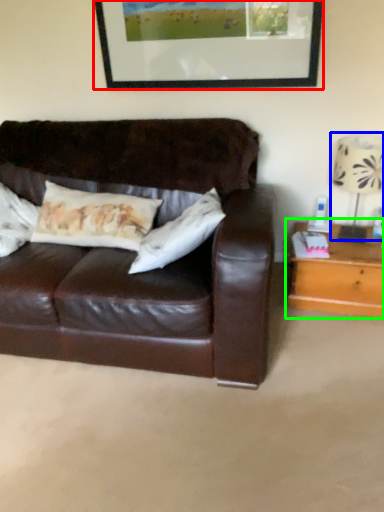
Question: Which object is the closest to the picture frame (highlighted by a red box)? Choose among these: table lamp (highlighted by a blue box) or table (highlighted by a green box).

Choices:
 (A) table lamp
 (B) table

Answer: (A)